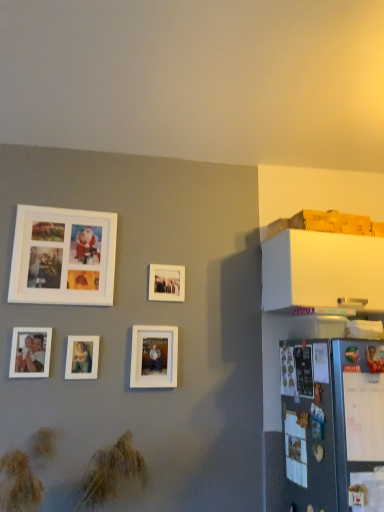
Question: Is white matte picture frame at upper left, which appears as the second picture frame when viewed from the left, in front of or behind matte white picture frame at center, the third picture frame from the left, in the image?

Choices:
 (A) front
 (B) behind

Answer: (A)

Question: From a real-world perspective, is white matte picture frame at upper left, which appears as the second picture frame when viewed from the left, above or below matte white picture frame at center, marked as the third picture frame in a right-to-left arrangement?

Choices:
 (A) below
 (B) above

Answer: (B)

Question: Estimate the real-world distances between objects in this image. Which object is farther from the matte white photo frame at lower left, the 1th picture frame viewed from the left?

Choices:
 (A) matte white picture frame at center, the third picture frame from the left
 (B) white matte picture frame at upper left, arranged as the 4th picture frame when viewed from the right
 (C) white matte picture frame at center, which is counted as the 1th picture frame, starting from the right
 (D) white matte picture frame at center, placed as the 2th picture frame when sorted from right to left

Answer: (C)

Question: Which is farther from the white matte picture frame at upper left, arranged as the 4th picture frame when viewed from the right?

Choices:
 (A) white matte picture frame at center, which is counted as the 1th picture frame, starting from the right
 (B) matte white picture frame at center, the third picture frame from the left
 (C) matte white photo frame at lower left, the 1th picture frame viewed from the left
 (D) white matte picture frame at center, placed as the 2th picture frame when sorted from right to left

Answer: (D)